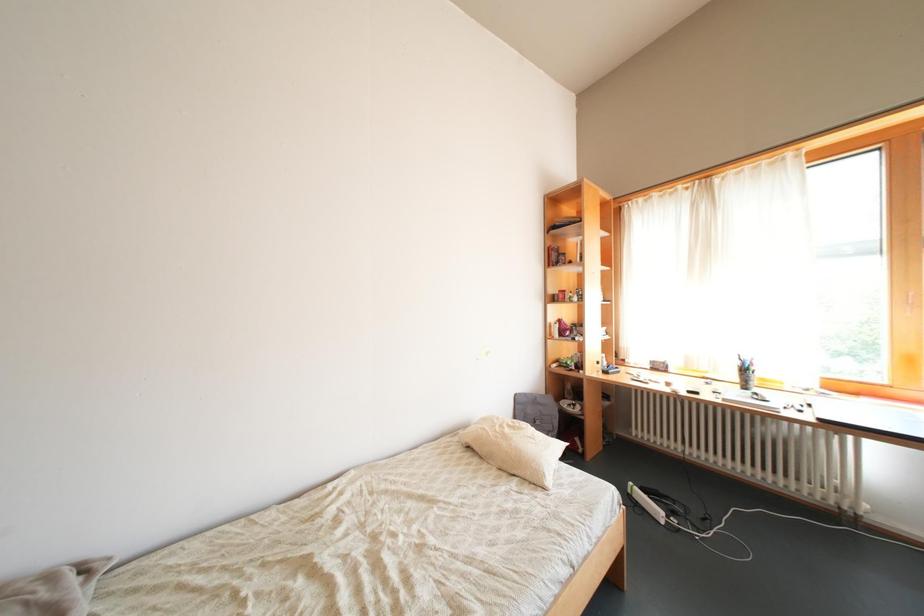
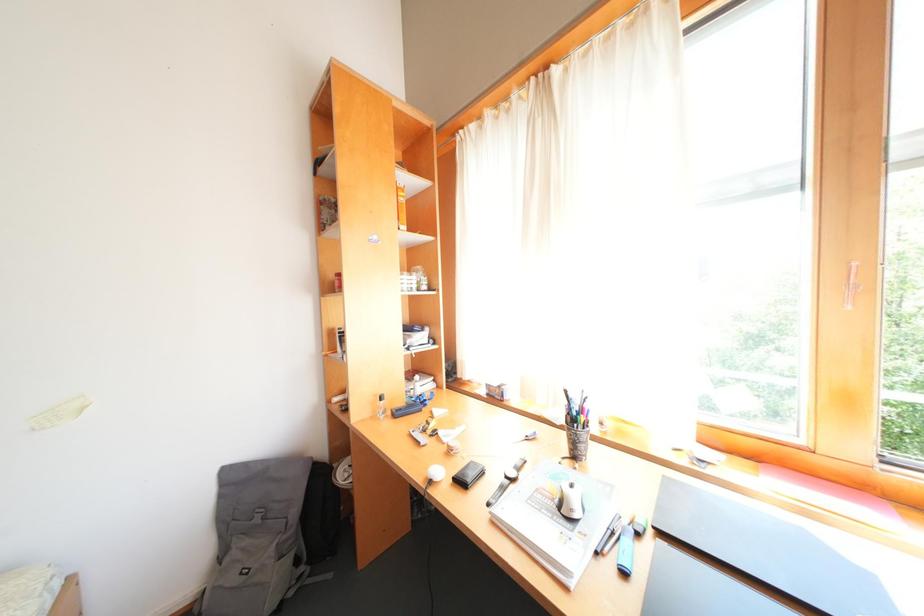
Which direction would the cameraman need to move to produce the second image?

The movement direction of the cameraman is right, forward.